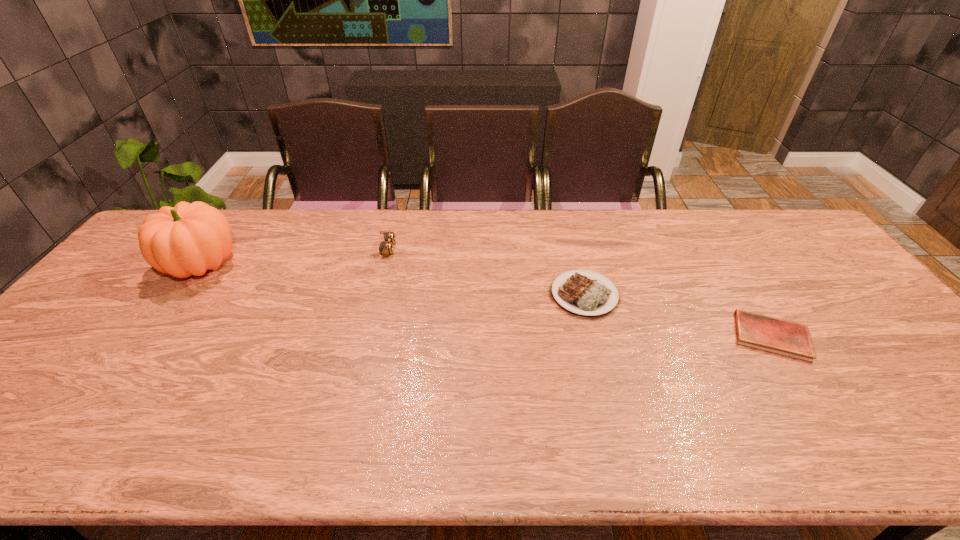
I want to click on free point that satisfies the following two spatial constraints: 1. on the front side of the second object from right to left; 2. on the left side of the pumpkin, so click(180, 295).

The width and height of the screenshot is (960, 540). I want to click on free space in the image that satisfies the following two spatial constraints: 1. through the lenses of the third shortest object; 2. on the left side of the shortest object, so click(x=364, y=336).